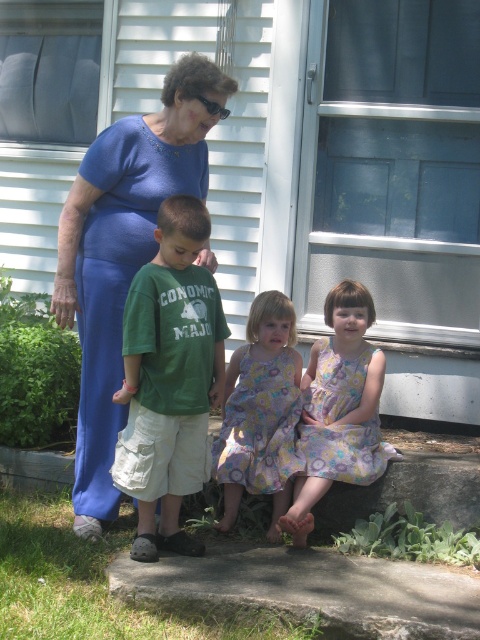
Question: Among these points, which one is nearest to the camera?

Choices:
 (A) 83,294
 (B) 389,456
 (C) 200,221
 (D) 222,470

Answer: (C)

Question: Does blue satin dress at upper left appear under floral dress at lower center?

Choices:
 (A) yes
 (B) no

Answer: (B)

Question: Can you confirm if blue satin dress at upper left is thinner than green cotton shirt at center?

Choices:
 (A) no
 (B) yes

Answer: (A)

Question: Does blue satin dress at upper left have a greater width compared to green cotton shirt at center?

Choices:
 (A) yes
 (B) no

Answer: (A)

Question: Which of the following is the closest to the observer?

Choices:
 (A) (87, 353)
 (B) (313, 372)

Answer: (A)

Question: Among these objects, which one is nearest to the camera?

Choices:
 (A) green cotton shirt at center
 (B) blue satin dress at upper left
 (C) floral dress at center
 (D) floral dress at lower center

Answer: (A)